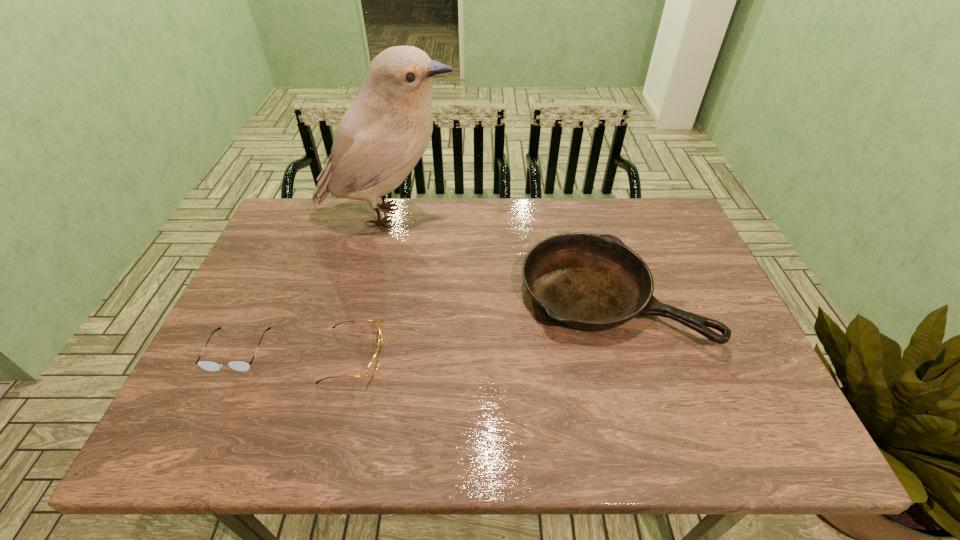
Locate an element on the screen. The height and width of the screenshot is (540, 960). free space at the far left corner of the desktop is located at coordinates 285,224.

Where is `vacant space at the far right corner of the desktop`? This screenshot has width=960, height=540. vacant space at the far right corner of the desktop is located at coordinates (655, 224).

The image size is (960, 540). Find the location of `vacant area between the farthest object and the right spectacles`. vacant area between the farthest object and the right spectacles is located at coordinates pyautogui.click(x=371, y=286).

At what (x,y) coordinates should I click in order to perform the action: click on vacant point located between the frying pan and the tallest object. Please return your answer as a coordinate pair (x, y). Image resolution: width=960 pixels, height=540 pixels. Looking at the image, I should click on (499, 256).

At what (x,y) coordinates should I click in order to perform the action: click on unoccupied position between the right spectacles and the parakeet. Please return your answer as a coordinate pair (x, y). This screenshot has height=540, width=960. Looking at the image, I should click on (371, 286).

The height and width of the screenshot is (540, 960). What are the coordinates of `vacant region between the right spectacles and the parakeet` in the screenshot? It's located at (371, 286).

This screenshot has height=540, width=960. Identify the location of vacant area that lies between the right spectacles and the second tallest object. (482, 326).

You are a GUI agent. You are given a task and a screenshot of the screen. Output one action in this format:
    pyautogui.click(x=<x>, y=<y>)
    Task: Click on the vacant area that lies between the frying pan and the shorter spectacles
    
    Given the screenshot: What is the action you would take?
    pyautogui.click(x=424, y=323)

Where is `free spot between the right spectacles and the second tallest object`? free spot between the right spectacles and the second tallest object is located at coordinates (482, 326).

This screenshot has width=960, height=540. I want to click on vacant region between the tallest object and the frying pan, so click(499, 256).